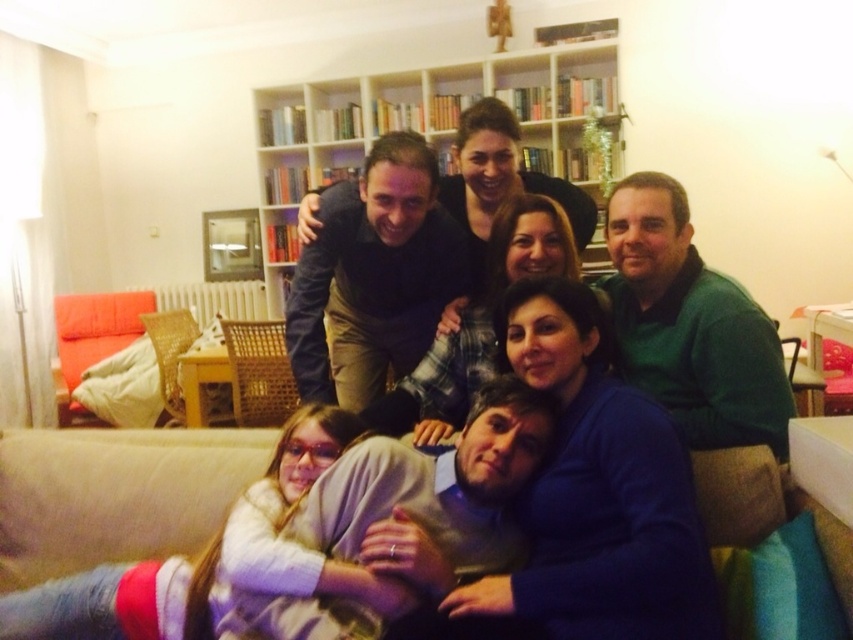
Question: Is beige fabric couch at lower center wider than wooden bookshelf at upper center?

Choices:
 (A) yes
 (B) no

Answer: (B)

Question: Observing the image, what is the correct spatial positioning of beige fabric couch at lower center in reference to wooden bookshelf at upper center?

Choices:
 (A) left
 (B) right

Answer: (A)

Question: Is beige fabric couch at lower center closer to camera compared to wooden bookshelf at upper center?

Choices:
 (A) yes
 (B) no

Answer: (A)

Question: Which of the following is the closest to the observer?

Choices:
 (A) wooden bookshelf at upper center
 (B) beige fabric couch at lower center

Answer: (B)

Question: Which object is closer to the camera taking this photo?

Choices:
 (A) wooden bookshelf at upper center
 (B) beige fabric couch at lower center

Answer: (B)